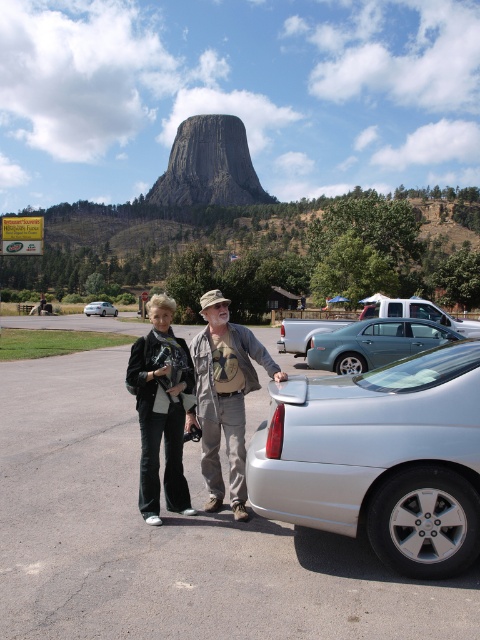
Question: Is white matte suv at center positioned in front of silver metallic sedan at center?

Choices:
 (A) yes
 (B) no

Answer: (A)

Question: Is silver metallic car at lower right below silver metallic sedan at center?

Choices:
 (A) no
 (B) yes

Answer: (B)

Question: Which object is the closest to the white matte suv at center?

Choices:
 (A) black denim jacket at center
 (B) metallic silver sedan at center

Answer: (B)

Question: Does metallic silver car at lower right appear on the right side of metallic silver sedan at center?

Choices:
 (A) yes
 (B) no

Answer: (B)

Question: Among these objects, which one is farthest from the camera?

Choices:
 (A) metallic silver car at lower right
 (B) matte black jacket at center

Answer: (B)

Question: Which of the following is the closest to the observer?

Choices:
 (A) black denim jacket at center
 (B) white matte suv at center

Answer: (A)